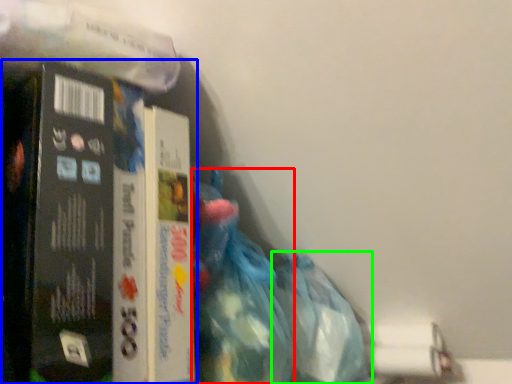
Question: Estimate the real-world distances between objects in this image. Which object is closer to waste (highlighted by a red box), book (highlighted by a blue box) or plastic bag (highlighted by a green box)?

Choices:
 (A) book
 (B) plastic bag

Answer: (B)